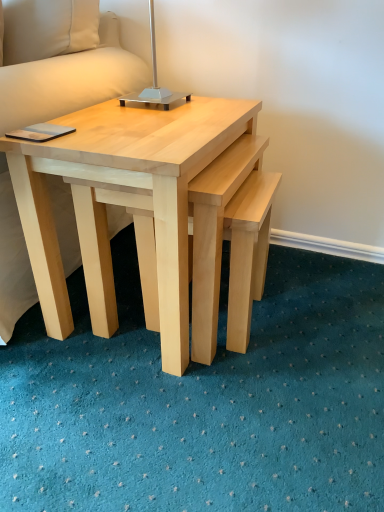
At what (x,y) coordinates should I click in order to perform the action: click on free location in front of natural wood coffee table at center. Please return your answer as a coordinate pair (x, y). Looking at the image, I should click on (172, 421).